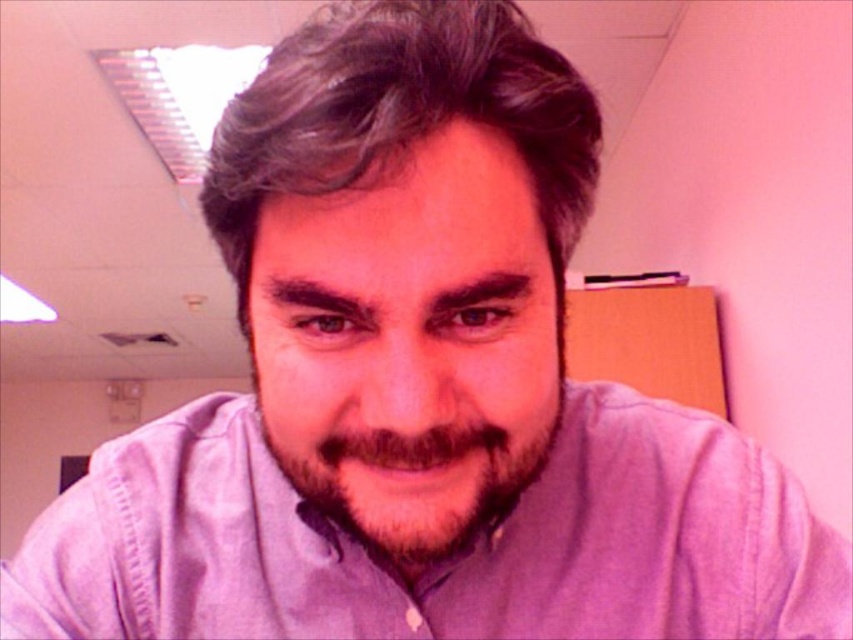
Does gray matte hair at center lie in front of brown fuzzy beard at center?

Yes, gray matte hair at center is closer to the viewer.

Can you confirm if gray matte hair at center is thinner than brown fuzzy beard at center?

No, gray matte hair at center is not thinner than brown fuzzy beard at center.

Is point (573, 132) in front of point (375, 470)?

Yes, point (573, 132) is closer to viewer.

Image resolution: width=853 pixels, height=640 pixels. What are the coordinates of `gray matte hair at center` in the screenshot? It's located at coord(399,115).

Can you confirm if purple cotton shirt at center is positioned below brown fuzzy beard at center?

Yes, purple cotton shirt at center is below brown fuzzy beard at center.

Who is more distant from viewer, (712, 636) or (490, 452)?

Positioned behind is point (712, 636).

The image size is (853, 640). Find the location of `purple cotton shirt at center`. purple cotton shirt at center is located at coordinates (445, 556).

Can you confirm if purple cotton shirt at center is shorter than gray matte hair at center?

Yes, purple cotton shirt at center is shorter than gray matte hair at center.

Is purple cotton shirt at center positioned before gray matte hair at center?

No, purple cotton shirt at center is behind gray matte hair at center.

What do you see at coordinates (445, 556) in the screenshot? I see `purple cotton shirt at center` at bounding box center [445, 556].

I want to click on purple cotton shirt at center, so click(x=445, y=556).